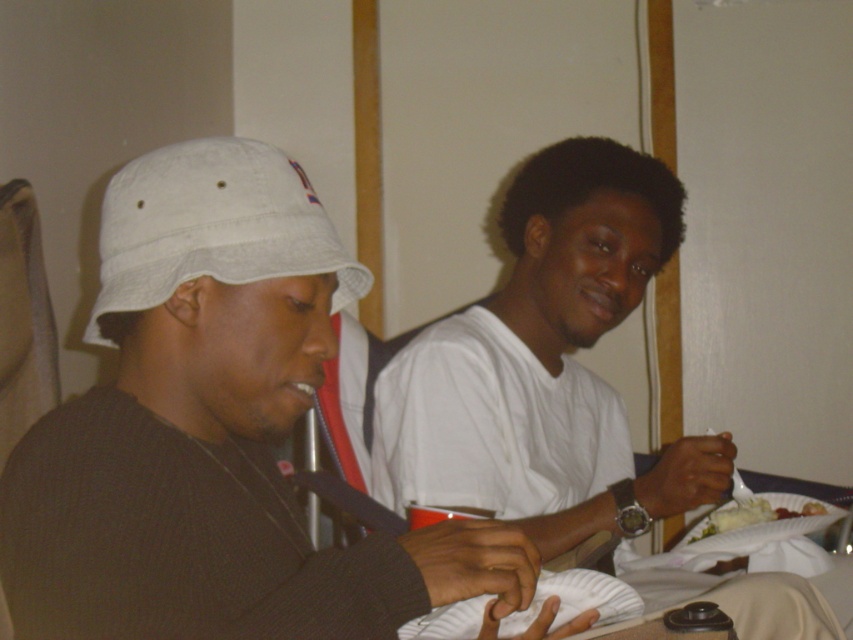
Can you confirm if white matte shirt at center is positioned to the left of white creamy mashed potatoes at lower right?

Yes, white matte shirt at center is to the left of white creamy mashed potatoes at lower right.

Who is more forward, [396,372] or [766,522]?

Positioned in front is point [396,372].

Locate an element on the screen. The height and width of the screenshot is (640, 853). white matte shirt at center is located at coordinates (546, 365).

You are a GUI agent. You are given a task and a screenshot of the screen. Output one action in this format:
    pyautogui.click(x=<x>, y=<y>)
    Task: Click on the white matte shirt at center
    Image resolution: width=853 pixels, height=640 pixels.
    Given the screenshot: What is the action you would take?
    pyautogui.click(x=546, y=365)

Between point (469, 444) and point (202, 209), which one is positioned in front?

Point (202, 209) is more forward.

Is point (500, 314) positioned before point (202, 179)?

No, (500, 314) is behind (202, 179).

Locate an element on the screen. The height and width of the screenshot is (640, 853). white matte shirt at center is located at coordinates (x=546, y=365).

Can you confirm if white matte bucket hat at left is taller than white matte shirt at center?

No.

Who is more forward, (294,163) or (538,170)?

Point (294,163) is more forward.

You are a GUI agent. You are given a task and a screenshot of the screen. Output one action in this format:
    pyautogui.click(x=<x>, y=<y>)
    Task: Click on the white matte bucket hat at left
    The height and width of the screenshot is (640, 853).
    Given the screenshot: What is the action you would take?
    pyautogui.click(x=215, y=433)